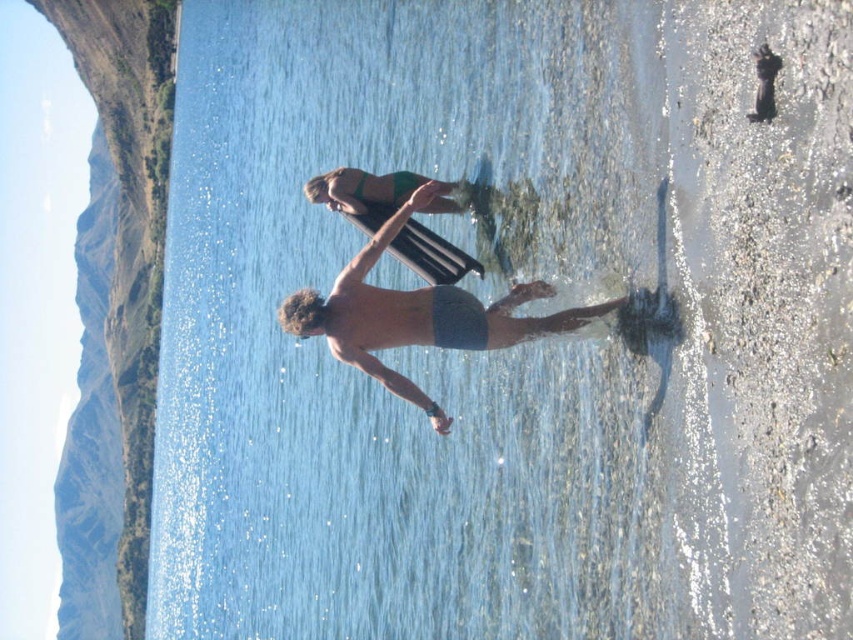
Question: Is rocky cliff at left above gray fabric shorts at center?

Choices:
 (A) yes
 (B) no

Answer: (A)

Question: Among these objects, which one is farthest from the camera?

Choices:
 (A) gray fabric shorts at center
 (B) rocky cliff at left

Answer: (B)

Question: Is rocky cliff at left positioned before gray fabric shorts at center?

Choices:
 (A) no
 (B) yes

Answer: (A)

Question: Does rocky cliff at left appear on the right side of gray fabric shorts at center?

Choices:
 (A) yes
 (B) no

Answer: (B)

Question: Among these objects, which one is nearest to the camera?

Choices:
 (A) gray fabric shorts at center
 (B) rocky cliff at left

Answer: (A)